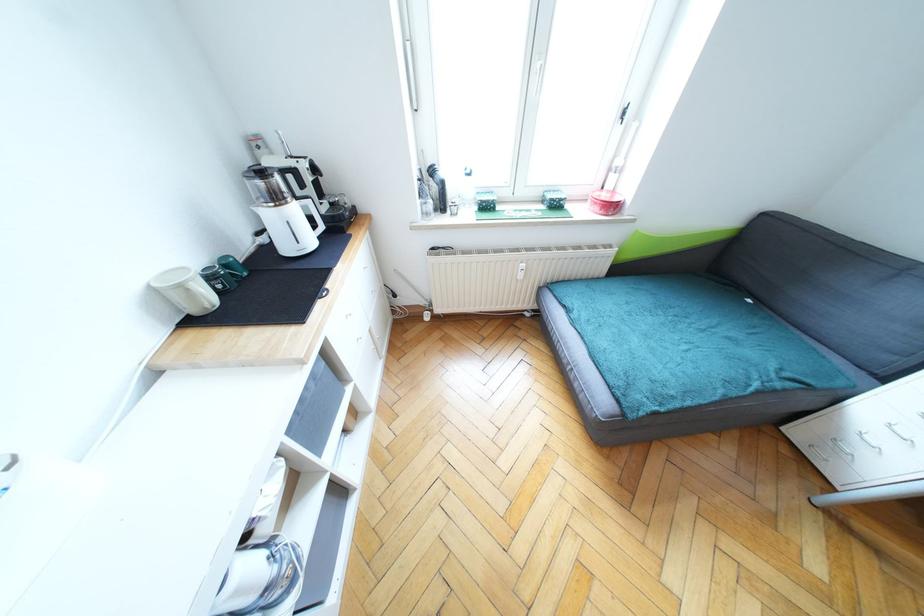
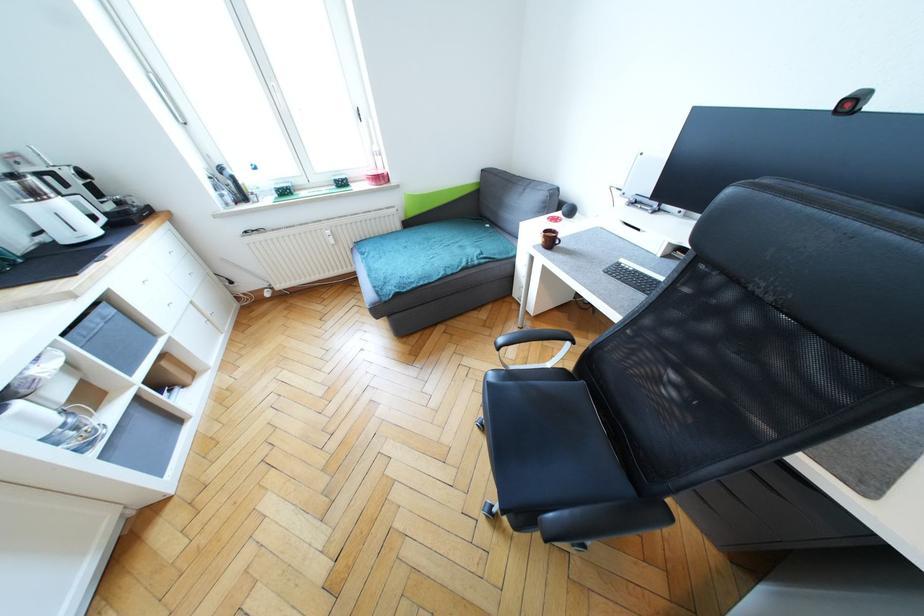
In the second image, find the point that corresponds to point 760,386 in the first image.

(467, 265)